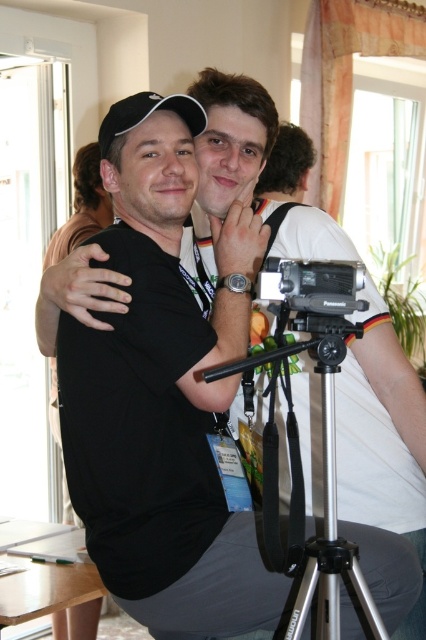
You are setting up equipment for a photo shoot. You have a silver metallic tripod at center and a black plastic camera at center. Which one has a larger base width?

The silver metallic tripod at center might be wider than black plastic camera at center according to the description.